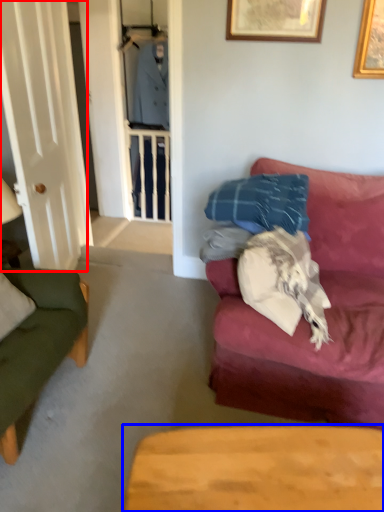
Question: Which point is closer to the camera, glass door (highlighted by a red box) or table (highlighted by a blue box)?

Choices:
 (A) glass door
 (B) table

Answer: (B)